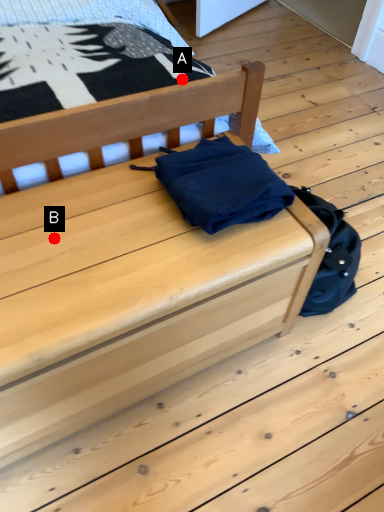
Question: Two points are circled on the image, labeled by A and B beside each circle. Which point is farther to the camera?

Choices:
 (A) A is further
 (B) B is further

Answer: (A)